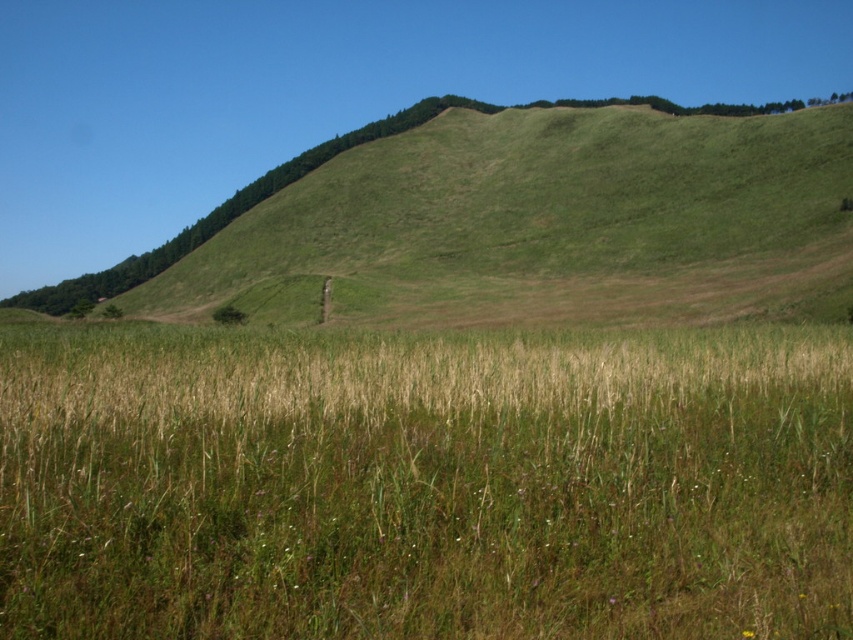
Which is in front, point (73, 451) or point (215, 262)?

Point (73, 451)

Does green grass at center appear under green grassy hillside at upper center?

Yes, green grass at center is below green grassy hillside at upper center.

Which is in front, point (828, 529) or point (849, 275)?

Point (828, 529) is more forward.

In order to click on green grass at center in this screenshot , I will do `click(424, 483)`.